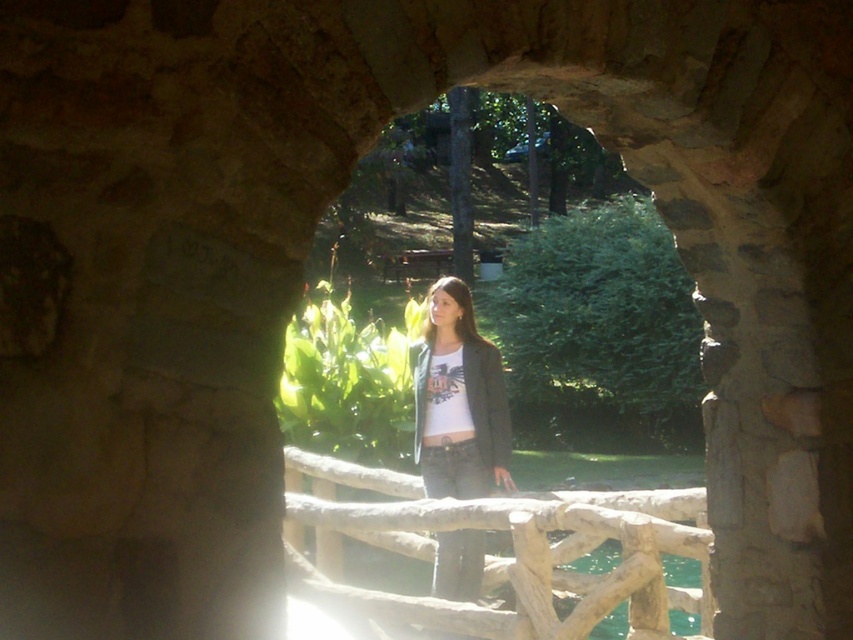
Question: Which of the following is the farthest from the observer?

Choices:
 (A) matte black jacket at center
 (B) wooden at center

Answer: (A)

Question: Where is wooden at center located in relation to matte black jacket at center in the image?

Choices:
 (A) left
 (B) right

Answer: (B)

Question: Can you confirm if wooden at center is positioned to the left of matte black jacket at center?

Choices:
 (A) yes
 (B) no

Answer: (B)

Question: Among these points, which one is nearest to the camera?

Choices:
 (A) (498, 616)
 (B) (480, 438)

Answer: (A)

Question: Does wooden at center have a larger size compared to matte black jacket at center?

Choices:
 (A) no
 (B) yes

Answer: (B)

Question: Which of the following is the farthest from the observer?

Choices:
 (A) (523, 573)
 (B) (482, 432)

Answer: (B)